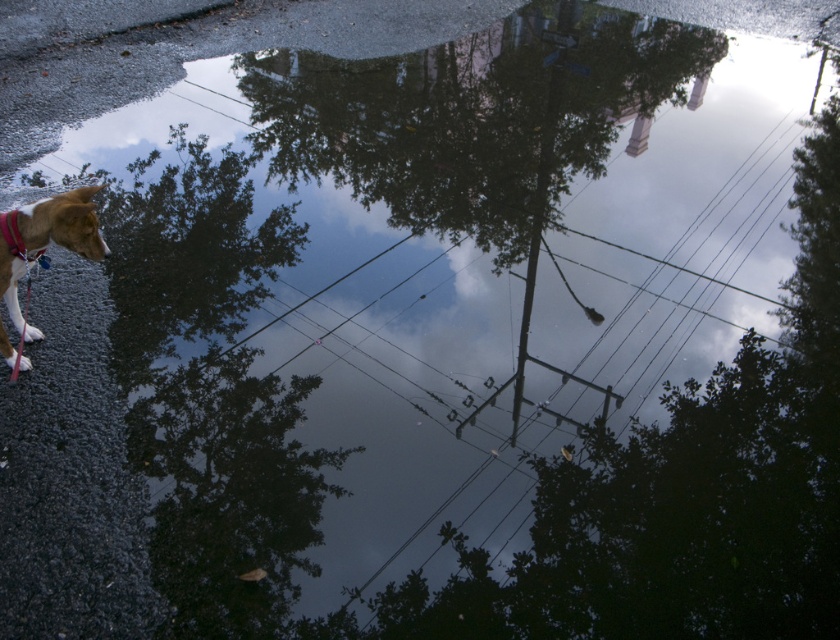
Question: Which point is farther from the camera taking this photo?

Choices:
 (A) (0, 216)
 (B) (11, 285)

Answer: (B)

Question: Is brown fur dog at left thinner than red fabric collar at left?

Choices:
 (A) yes
 (B) no

Answer: (B)

Question: Does brown fur dog at left appear on the right side of red fabric collar at left?

Choices:
 (A) no
 (B) yes

Answer: (B)

Question: Can you confirm if brown fur dog at left is positioned to the right of red fabric collar at left?

Choices:
 (A) yes
 (B) no

Answer: (A)

Question: Among these objects, which one is farthest from the camera?

Choices:
 (A) red fabric collar at left
 (B) brown fur dog at left

Answer: (A)

Question: Among these points, which one is farthest from the camera?

Choices:
 (A) (19, 236)
 (B) (6, 241)

Answer: (A)